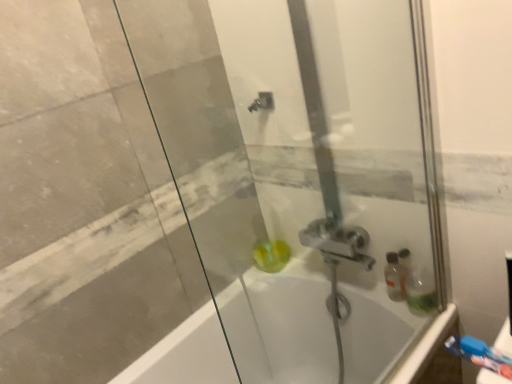
Question: From a real-world perspective, is blue plastic toothbrush at lower right below transparent glass shower door at center?

Choices:
 (A) yes
 (B) no

Answer: (A)

Question: Does blue plastic toothbrush at lower right have a larger size compared to transparent glass shower door at center?

Choices:
 (A) yes
 (B) no

Answer: (B)

Question: Does blue plastic toothbrush at lower right have a greater height compared to transparent glass shower door at center?

Choices:
 (A) yes
 (B) no

Answer: (B)

Question: Is transparent glass shower door at center surrounded by blue plastic toothbrush at lower right?

Choices:
 (A) yes
 (B) no

Answer: (B)

Question: Is blue plastic toothbrush at lower right to the left of transparent glass shower door at center from the viewer's perspective?

Choices:
 (A) yes
 (B) no

Answer: (B)

Question: Does blue plastic toothbrush at lower right have a greater width compared to transparent glass shower door at center?

Choices:
 (A) no
 (B) yes

Answer: (B)

Question: From a real-world perspective, does blue plastic toothbrush at lower right stand above translucent green soap at center?

Choices:
 (A) yes
 (B) no

Answer: (A)

Question: Is blue plastic toothbrush at lower right far away from translucent green soap at center?

Choices:
 (A) yes
 (B) no

Answer: (B)

Question: Is blue plastic toothbrush at lower right positioned behind translucent green soap at center?

Choices:
 (A) yes
 (B) no

Answer: (B)

Question: From the image's perspective, is blue plastic toothbrush at lower right below translucent green soap at center?

Choices:
 (A) yes
 (B) no

Answer: (A)

Question: Does blue plastic toothbrush at lower right have a lesser height compared to translucent green soap at center?

Choices:
 (A) yes
 (B) no

Answer: (A)

Question: Is blue plastic toothbrush at lower right not inside translucent green soap at center?

Choices:
 (A) yes
 (B) no

Answer: (A)

Question: Considering the relative positions of translucent green soap at center and blue plastic toothbrush at lower right in the image provided, is translucent green soap at center to the left of blue plastic toothbrush at lower right from the viewer's perspective?

Choices:
 (A) no
 (B) yes

Answer: (B)